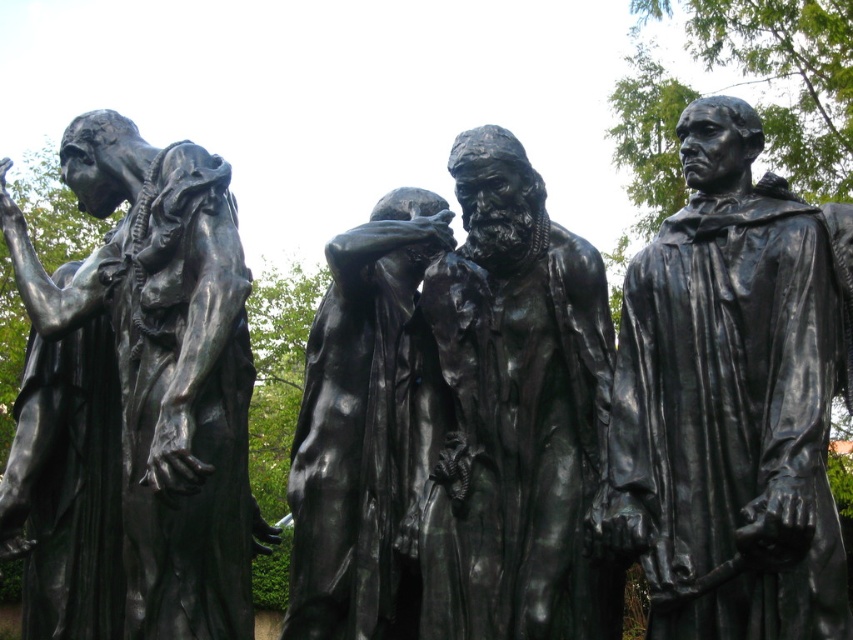
You are standing in a park and see the black bronze statue at center. If you want to reach the statue within 10 seconds, what is the minimum running speed you need to maintain?

The distance between you and the black bronze statue at center is 39.87 meters. To cover this distance in 10 seconds, you would need to run at a minimum speed of approximately 3.987 meters per second.

You are standing in front of the statues and want to take a photo of the bronze statue at left and the black bronze statue at center. Which statue should be on the left side of the photo to capture them in their actual positions?

To capture them in their actual positions, the bronze statue at left should be on the left side of the photo since the black bronze statue at center is to the right of it.